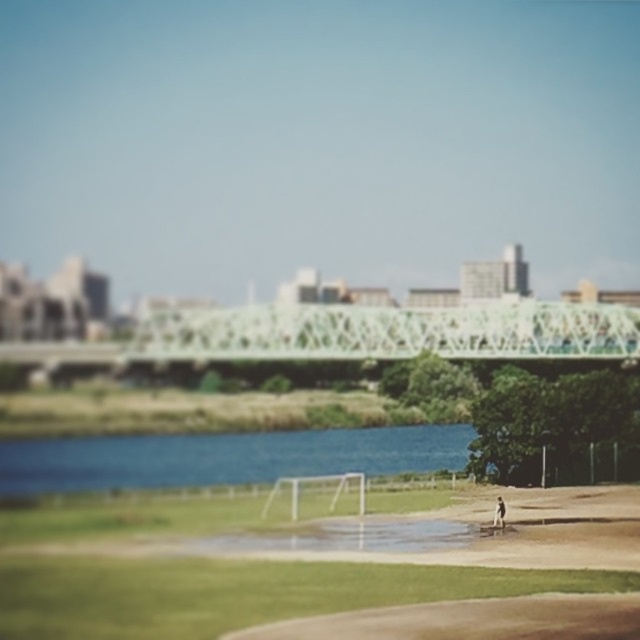
Can you confirm if brown dirt track at lower center is smaller than dark brown leather jacket at lower right?

Yes, brown dirt track at lower center is smaller than dark brown leather jacket at lower right.

Is brown dirt track at lower center in front of dark brown leather jacket at lower right?

That is True.

Does point (593, 625) come in front of point (502, 516)?

Yes.

Where is `brown dirt track at lower center`? The image size is (640, 640). brown dirt track at lower center is located at coordinates (470, 620).

Who is more distant from viewer, (8, 476) or (339, 637)?

Point (8, 476)

Can you confirm if blue water at center is bigger than brown dirt track at lower center?

Correct, blue water at center is larger in size than brown dirt track at lower center.

This screenshot has width=640, height=640. I want to click on blue water at center, so click(x=225, y=458).

Does blue water at center have a lesser height compared to dark brown leather jacket at lower right?

Yes, blue water at center is shorter than dark brown leather jacket at lower right.

How much distance is there between blue water at center and dark brown leather jacket at lower right?

blue water at center is 36.74 meters from dark brown leather jacket at lower right.

Identify the location of blue water at center. The width and height of the screenshot is (640, 640). (225, 458).

Locate an element on the screen. This screenshot has width=640, height=640. blue water at center is located at coordinates (225, 458).